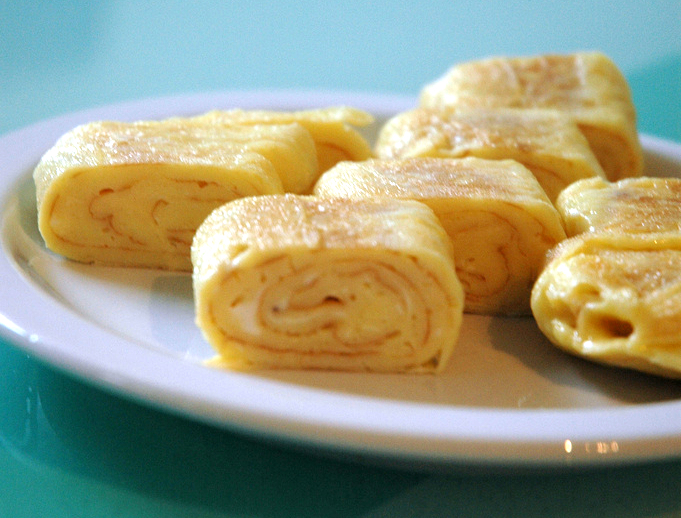
You are a GUI agent. You are given a task and a screenshot of the screen. Output one action in this format:
    pyautogui.click(x=<x>, y=<y>)
    Task: Click on the white plate
    
    Given the screenshot: What is the action you would take?
    pyautogui.click(x=459, y=437)